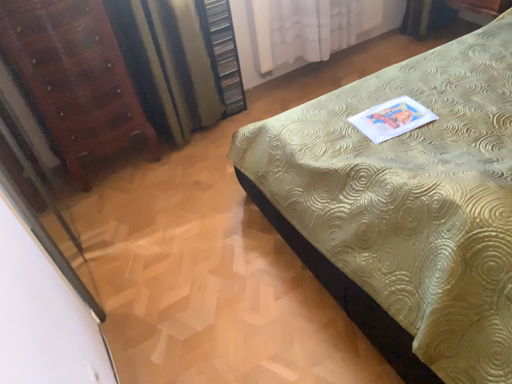
Locate an element on the screen. The height and width of the screenshot is (384, 512). free space between gold textured bed at center and transparent glass screen door at left is located at coordinates (191, 266).